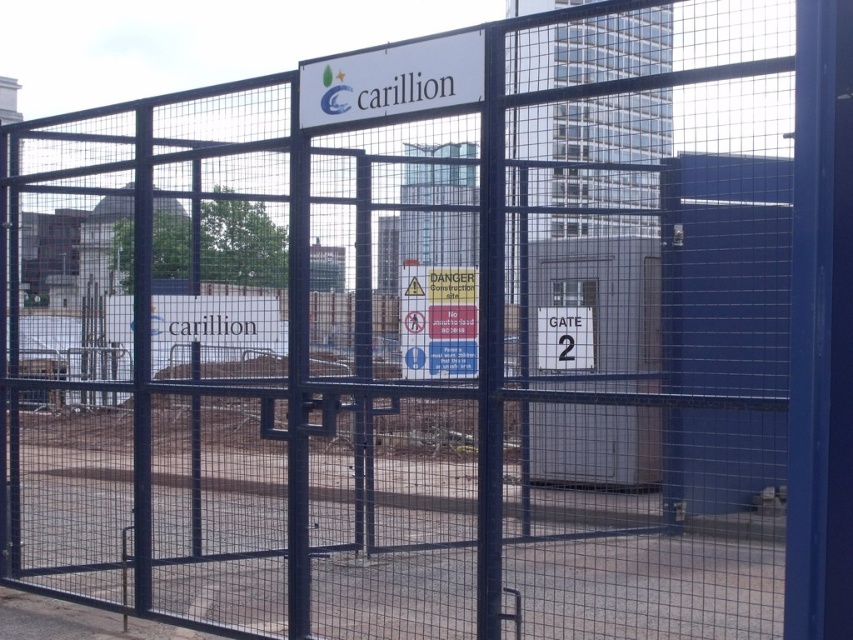
Question: Is white plastic sign at upper center closer to camera compared to white plastic gate at center?

Choices:
 (A) no
 (B) yes

Answer: (B)

Question: Which object is closer to the camera taking this photo?

Choices:
 (A) white plastic sign at upper center
 (B) white plastic sign at center

Answer: (A)

Question: Which of the following is the closest to the observer?

Choices:
 (A) white plastic sign at center
 (B) white plastic gate at center
 (C) white plastic sign at upper center

Answer: (C)

Question: Which of the following is the farthest from the observer?

Choices:
 (A) (402, 333)
 (B) (566, 330)
 (C) (416, 77)

Answer: (B)

Question: Observing the image, what is the correct spatial positioning of white plastic sign at upper center in reference to white plastic gate at center?

Choices:
 (A) above
 (B) below

Answer: (A)

Question: Is white plastic sign at upper center below white plastic sign at center?

Choices:
 (A) yes
 (B) no

Answer: (B)